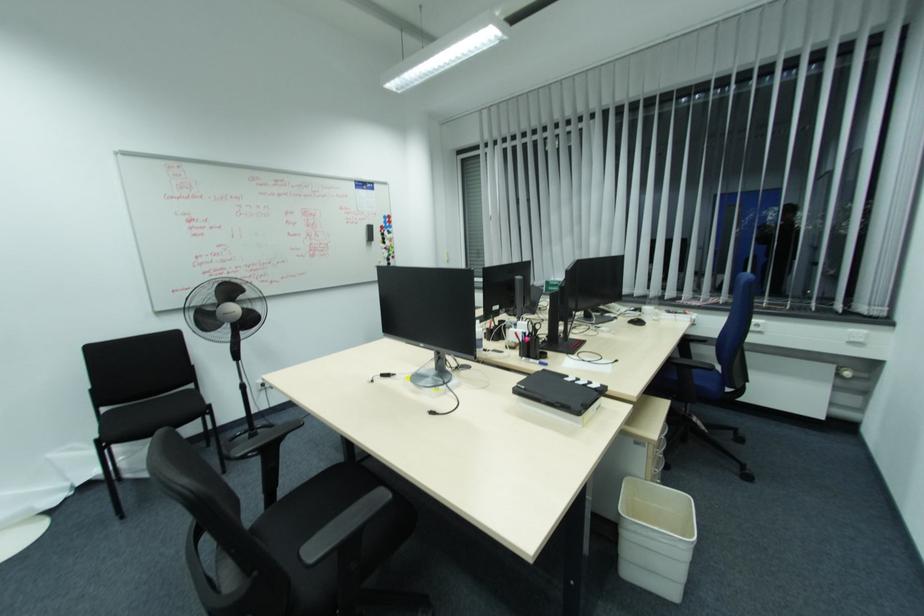
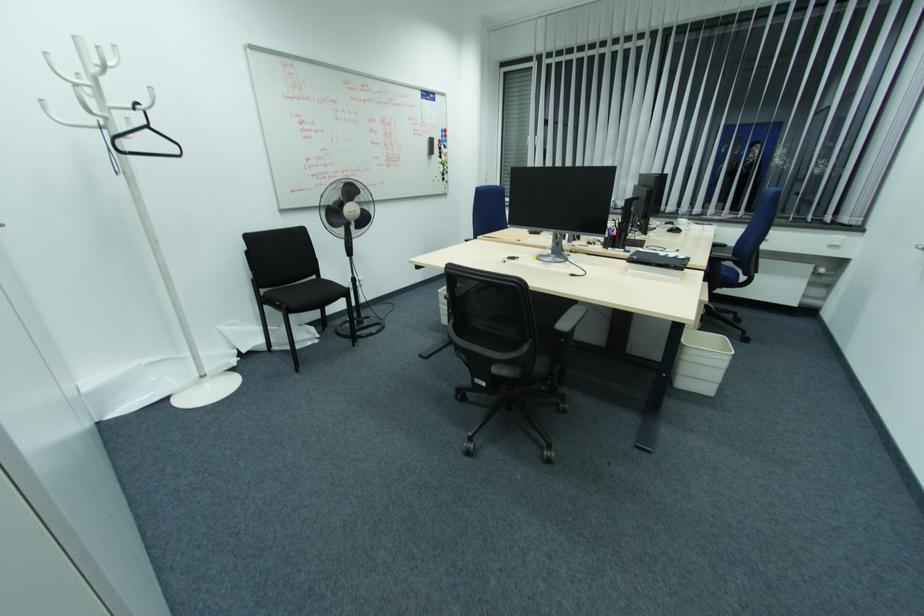
The point at (385, 217) is marked in the first image. Where is the corresponding point in the second image?

(444, 131)